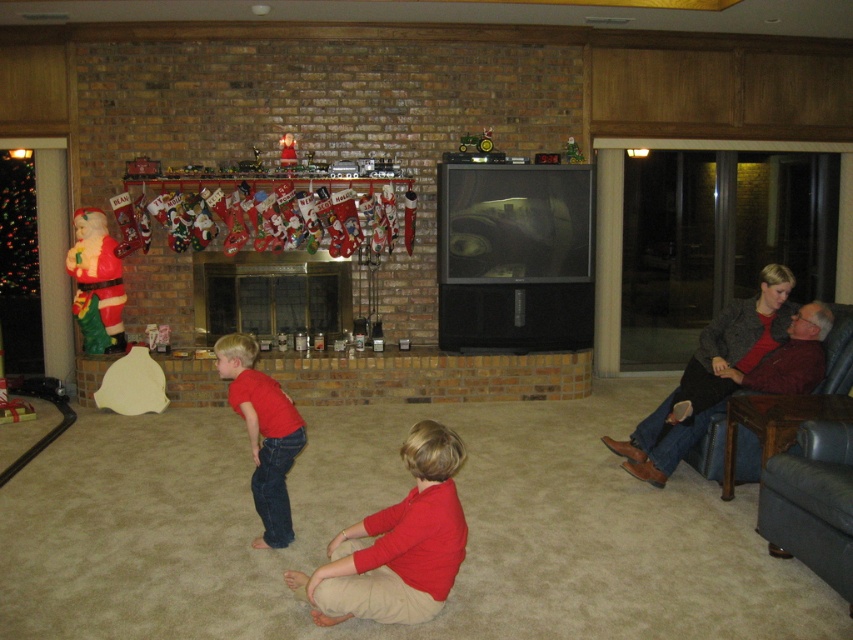
You are a guest in this living room and want to place a small gift for the host. The gift is meant to be placed near the stockings on the mantel. You have two options for placement spots near the stockings. One spot is where the matte red shirt at center currently is, and the other is where the plush fabric santa at left is. Which spot is closer to the stockings on the mantel?

The plush fabric santa at left is closer to the stockings on the mantel because the matte red shirt at center is positioned under it, meaning the Santa is above or in front of the shirt and thus nearer to the stockings.

You are organizing a festive photo shoot in the living room and want to place a white decorative pillow next to the matte red shirt at center. According to the scene description, where should you position the pillow relative to the shirt?

The matte red shirt at center is located at point [398,541]. To place the white decorative pillow next to it, position it near the coordinates provided, ensuring it aligns with the shirt in the center of the scene.